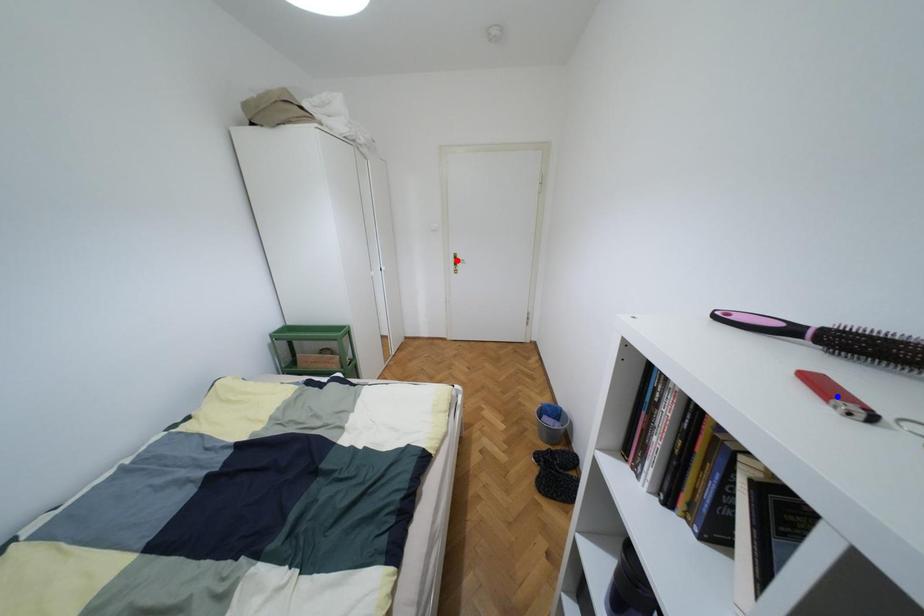
Question: In the image, two points are highlighted. Which point is nearer to the camera? Reply with the corresponding letter.

Choices:
 (A) blue point
 (B) red point

Answer: (A)